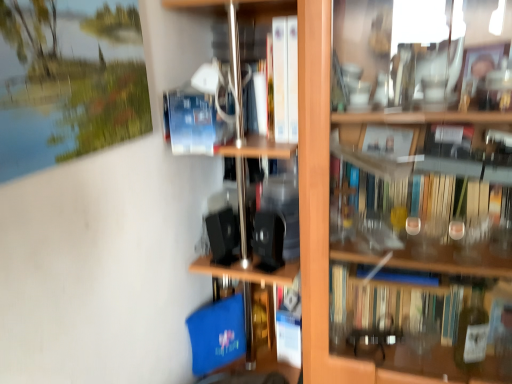
Question: Considering the positions of white paper at center and blue matte paperback book at center in the image, is white paper at center wider or thinner than blue matte paperback book at center?

Choices:
 (A) thin
 (B) wide

Answer: (A)

Question: Choose the correct answer: Is white paper at center inside blue matte paperback book at center or outside it?

Choices:
 (A) outside
 (B) inside

Answer: (A)

Question: Which object is positioned closest to the white paper at center?

Choices:
 (A) blue matte paperback book at center
 (B) wooden shelf at center

Answer: (B)

Question: Which of these objects is positioned farthest from the blue matte paperback book at center?

Choices:
 (A) white paper at center
 (B) wooden shelf at center

Answer: (B)